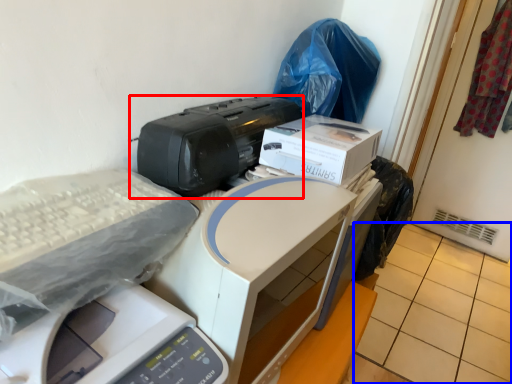
Question: Which object appears farthest to the camera in this image, printer (highlighted by a red box) or tile (highlighted by a blue box)?

Choices:
 (A) printer
 (B) tile

Answer: (B)